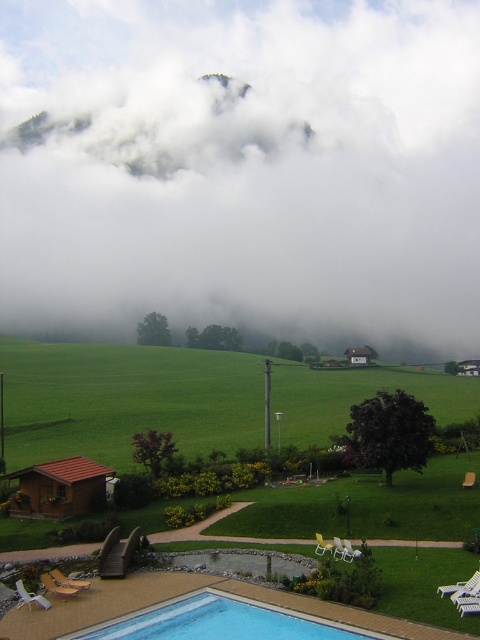
Question: Which point is closer to the camera?

Choices:
 (A) (277, 605)
 (B) (328, 408)

Answer: (A)

Question: Is green grassy hillside at lower left below blue tile swimming pool at lower center?

Choices:
 (A) no
 (B) yes

Answer: (A)

Question: Is white fluffy cloud at upper center further to camera compared to green grassy hillside at lower left?

Choices:
 (A) no
 (B) yes

Answer: (B)

Question: Is green grassy hillside at lower left further to the viewer compared to blue tile swimming pool at lower center?

Choices:
 (A) no
 (B) yes

Answer: (B)

Question: Which point is closer to the camera?

Choices:
 (A) (204, 424)
 (B) (259, 625)

Answer: (B)

Question: Which of the following is the closest to the observer?

Choices:
 (A) pos(343,396)
 (B) pos(73,227)

Answer: (A)